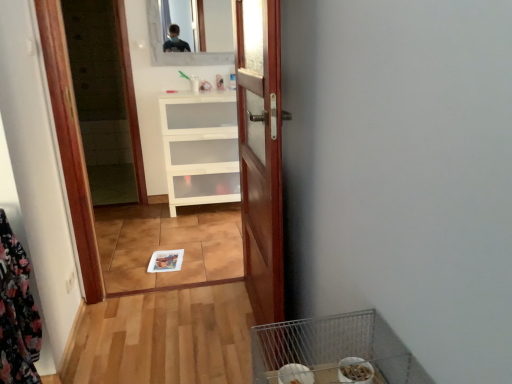
Where is `wooden door at center`? The width and height of the screenshot is (512, 384). wooden door at center is located at coordinates (260, 153).

Identify the location of metallic wire bird cage at lower right. The height and width of the screenshot is (384, 512). (333, 348).

This screenshot has height=384, width=512. Identify the location of floral fabric laundry at left. (17, 313).

This screenshot has width=512, height=384. I want to click on clear glass mirror at upper center, so click(x=218, y=25).

From the picture: Considering the relative positions of white matte cabinet at center and metallic wire bird cage at lower right in the image provided, is white matte cabinet at center behind metallic wire bird cage at lower right?

Yes, white matte cabinet at center is further from the camera.

From a real-world perspective, is white matte cabinet at center beneath metallic wire bird cage at lower right?

Correct, in the physical world, white matte cabinet at center is lower than metallic wire bird cage at lower right.

Who is taller, white matte cabinet at center or metallic wire bird cage at lower right?

white matte cabinet at center is taller.

Can metallic wire bird cage at lower right be found inside white matte cabinet at center?

No, metallic wire bird cage at lower right is not surrounded by white matte cabinet at center.

Who is shorter, white matte cabinet at center or clear glass mirror at upper center?

Standing shorter between the two is clear glass mirror at upper center.

Which is in front, white matte cabinet at center or clear glass mirror at upper center?

white matte cabinet at center is more forward.

Considering the points (175, 108) and (214, 49), which point is in front, point (175, 108) or point (214, 49)?

The point (175, 108) is in front.

Are white matte cabinet at center and clear glass mirror at upper center beside each other?

No, white matte cabinet at center is not in contact with clear glass mirror at upper center.

Between white matte cabinet at center and wooden door at center, which one has smaller width?

wooden door at center.

Is white matte cabinet at center taller than wooden door at center?

In fact, white matte cabinet at center may be shorter than wooden door at center.

Is white matte cabinet at center to the left of wooden door at center from the viewer's perspective?

Yes.

Who is more distant, white matte cabinet at center or wooden door at center?

white matte cabinet at center is more distant.

Which object is more forward, floral fabric laundry at left or clear glass mirror at upper center?

floral fabric laundry at left is more forward.

Can you confirm if floral fabric laundry at left is positioned to the left of clear glass mirror at upper center?

Yes, floral fabric laundry at left is to the left of clear glass mirror at upper center.

Where is `laundry that is on the left side of clear glass mirror at upper center`? laundry that is on the left side of clear glass mirror at upper center is located at coordinates (17, 313).

Considering the relative sizes of floral fabric laundry at left and clear glass mirror at upper center in the image provided, is floral fabric laundry at left thinner than clear glass mirror at upper center?

No.

Is metallic wire bird cage at lower right next to wooden door at center and touching it?

metallic wire bird cage at lower right is not next to wooden door at center, and they're not touching.

Based on the photo, is metallic wire bird cage at lower right smaller than wooden door at center?

Correct, metallic wire bird cage at lower right occupies less space than wooden door at center.

In terms of width, does metallic wire bird cage at lower right look wider or thinner when compared to wooden door at center?

Clearly, metallic wire bird cage at lower right has more width compared to wooden door at center.

From the image's perspective, which is above, metallic wire bird cage at lower right or wooden door at center?

wooden door at center is shown above in the image.

From a real-world perspective, is wooden door at center under white matte cabinet at center?

No, from a real-world perspective, wooden door at center is not under white matte cabinet at center.

Is wooden door at center taller than white matte cabinet at center?

Indeed, wooden door at center has a greater height compared to white matte cabinet at center.

From the image's perspective, who appears lower, wooden door at center or white matte cabinet at center?

wooden door at center, from the image's perspective.

Choose the correct answer: Is clear glass mirror at upper center inside metallic wire bird cage at lower right or outside it?

clear glass mirror at upper center lies outside metallic wire bird cage at lower right.

Does clear glass mirror at upper center have a lesser width compared to metallic wire bird cage at lower right?

Yes, clear glass mirror at upper center is thinner than metallic wire bird cage at lower right.

From a real-world perspective, is clear glass mirror at upper center on metallic wire bird cage at lower right?

Indeed, from a real-world perspective, clear glass mirror at upper center stands above metallic wire bird cage at lower right.

Is clear glass mirror at upper center taller or shorter than metallic wire bird cage at lower right?

clear glass mirror at upper center is taller than metallic wire bird cage at lower right.

Locate an element on the screen. Image resolution: width=512 pixels, height=384 pixels. cabinetry lying on the left of metallic wire bird cage at lower right is located at coordinates (200, 148).

Find the location of a particular element. This screenshot has height=384, width=512. cabinetry in front of the clear glass mirror at upper center is located at coordinates (200, 148).

Estimate the real-world distances between objects in this image. Which object is further from clear glass mirror at upper center, floral fabric laundry at left or white matte cabinet at center?

The object further to clear glass mirror at upper center is floral fabric laundry at left.

In the scene shown: From the image, which object appears to be farther from metallic wire bird cage at lower right, wooden door at center or floral fabric laundry at left?

Among the two, floral fabric laundry at left is located further to metallic wire bird cage at lower right.

Looking at the image, which one is located closer to wooden door at center, clear glass mirror at upper center or metallic wire bird cage at lower right?

Among the two, metallic wire bird cage at lower right is located nearer to wooden door at center.

Based on their spatial positions, is wooden door at center or clear glass mirror at upper center further from white matte cabinet at center?

Based on the image, wooden door at center appears to be further to white matte cabinet at center.

Looking at the image, which one is located closer to wooden door at center, white matte cabinet at center or clear glass mirror at upper center?

white matte cabinet at center is closer to wooden door at center.

When comparing their distances from wooden door at center, does floral fabric laundry at left or metallic wire bird cage at lower right seem closer?

metallic wire bird cage at lower right lies closer to wooden door at center than the other object.

Looking at this image, which object lies nearer to the anchor point clear glass mirror at upper center, white matte cabinet at center or wooden door at center?

white matte cabinet at center is positioned closer to the anchor clear glass mirror at upper center.

Based on the photo, considering their positions, is clear glass mirror at upper center positioned closer to white matte cabinet at center than wooden door at center?

clear glass mirror at upper center is closer to white matte cabinet at center.

The image size is (512, 384). What are the coordinates of `door positioned between floral fabric laundry at left and white matte cabinet at center from near to far` in the screenshot? It's located at (260, 153).

Locate an element on the screen. This screenshot has height=384, width=512. cabinetry between floral fabric laundry at left and clear glass mirror at upper center from front to back is located at coordinates (200, 148).

Find the location of a particular element. Image resolution: width=512 pixels, height=384 pixels. door located between floral fabric laundry at left and metallic wire bird cage at lower right in the left-right direction is located at coordinates (260, 153).

Identify the location of cabinetry located between metallic wire bird cage at lower right and clear glass mirror at upper center in the depth direction. The height and width of the screenshot is (384, 512). (200, 148).